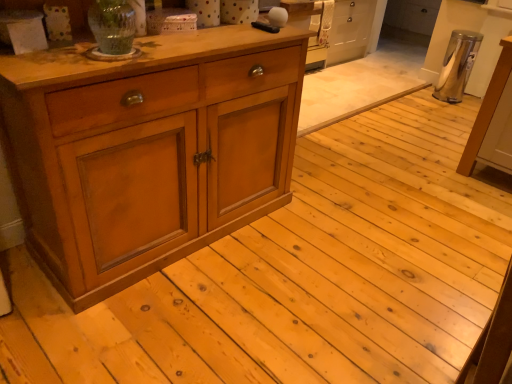
Where is `vacant space in front of matte wood cabinet at center`? Image resolution: width=512 pixels, height=384 pixels. vacant space in front of matte wood cabinet at center is located at coordinates (165, 321).